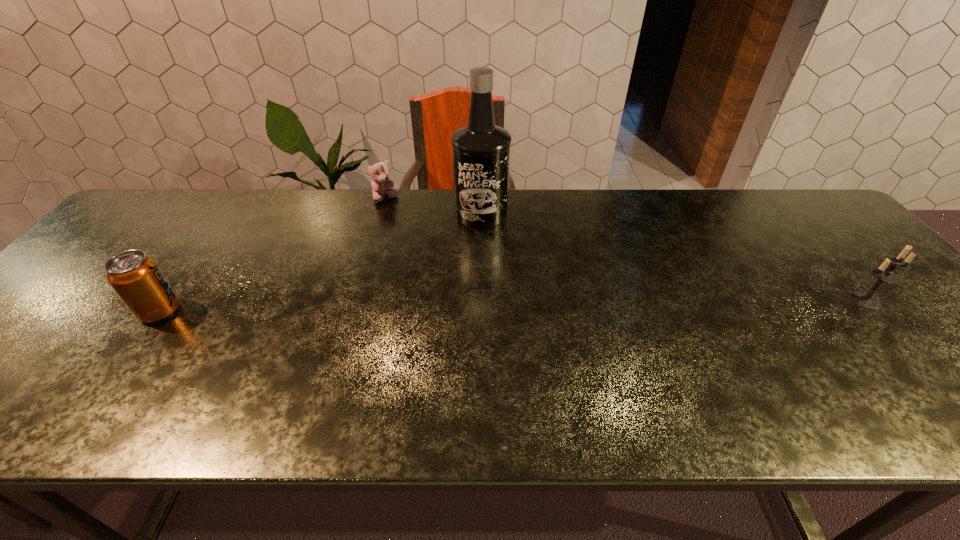
Where is `vacant point located on the front label of the liquor`? Image resolution: width=960 pixels, height=540 pixels. vacant point located on the front label of the liquor is located at coordinates (492, 329).

Locate an element on the screen. The image size is (960, 540). free location located at the face of the teddy bear is located at coordinates point(392,221).

The image size is (960, 540). In order to click on vacant space located 0.390m at the face of the teddy bear in this screenshot , I will do `click(411, 288)`.

Where is `vacant space located at the face of the teddy bear`? This screenshot has width=960, height=540. vacant space located at the face of the teddy bear is located at coordinates (406, 271).

Locate an element on the screen. This screenshot has height=540, width=960. liquor that is at the far edge is located at coordinates (481, 150).

At what (x,y) coordinates should I click in order to perform the action: click on teddy bear that is at the far edge. Please return your answer as a coordinate pair (x, y). This screenshot has width=960, height=540. Looking at the image, I should click on (382, 186).

I want to click on object positioned at the right edge, so click(884, 274).

In order to click on vacant region at the far edge of the desktop in this screenshot , I will do `click(279, 222)`.

Locate an element on the screen. The image size is (960, 540). vacant area at the near edge of the desktop is located at coordinates (738, 360).

In the image, there is a desktop. At what (x,y) coordinates should I click in order to perform the action: click on free space at the right edge. Please return your answer as a coordinate pair (x, y). Image resolution: width=960 pixels, height=540 pixels. Looking at the image, I should click on (893, 309).